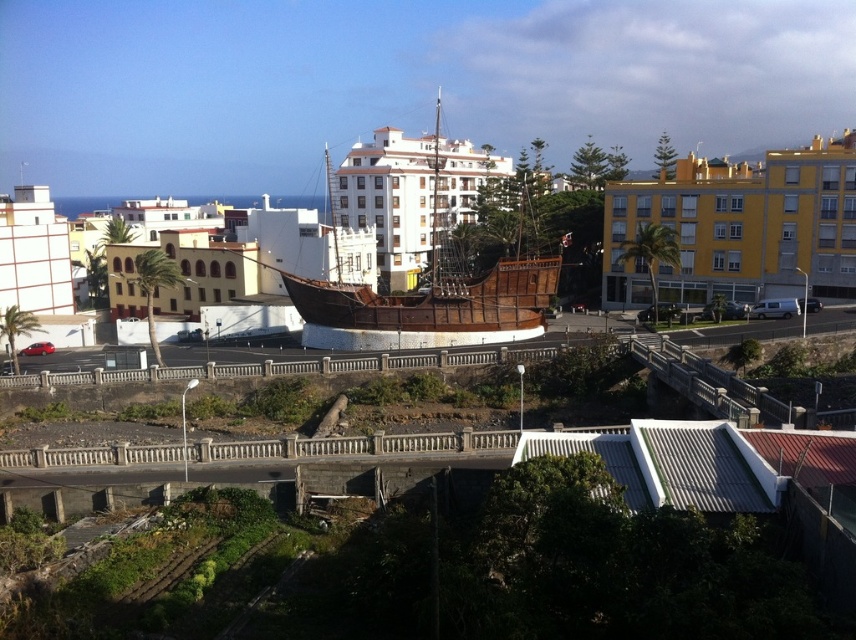
Question: Can you confirm if yellow matte building at center is smaller than white textured building at left?

Choices:
 (A) yes
 (B) no

Answer: (B)

Question: Is wooden pirate ship at center below white textured building at left?

Choices:
 (A) yes
 (B) no

Answer: (B)

Question: Which is farther from the white textured building at left?

Choices:
 (A) yellow matte building at center
 (B) white matte building at center

Answer: (A)

Question: From the image, what is the correct spatial relationship of yellow matte building at center in relation to white matte building at center?

Choices:
 (A) below
 (B) above

Answer: (A)

Question: Which point is farther from the camera taking this photo?

Choices:
 (A) (759, 214)
 (B) (22, 250)
 (C) (411, 282)
 (D) (431, 168)

Answer: (D)

Question: Which point is closer to the camera?

Choices:
 (A) (744, 186)
 (B) (373, 346)
 (C) (446, 198)
 (D) (42, 204)

Answer: (B)